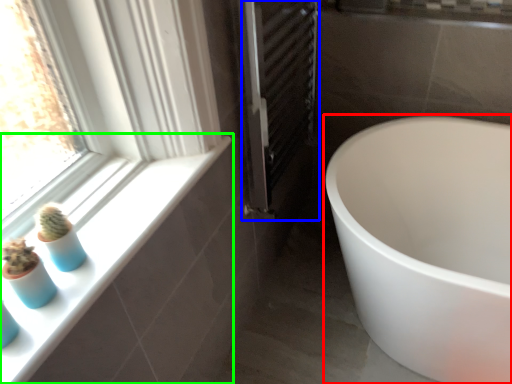
Question: Which object is the farthest from bathtub (highlighted by a red box)? Choose among these: screen door (highlighted by a blue box) or window sill (highlighted by a green box).

Choices:
 (A) screen door
 (B) window sill

Answer: (B)